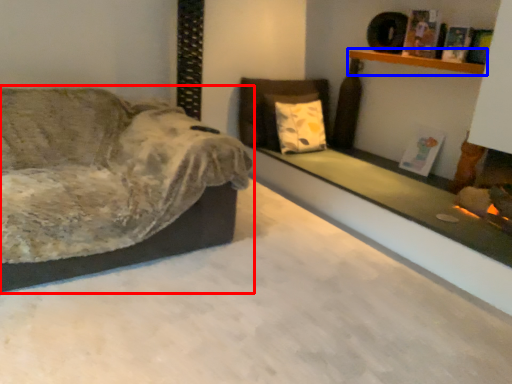
Question: Which of the following is the closest to the observer, studio couch (highlighted by a red box) or shelf (highlighted by a blue box)?

Choices:
 (A) studio couch
 (B) shelf

Answer: (A)